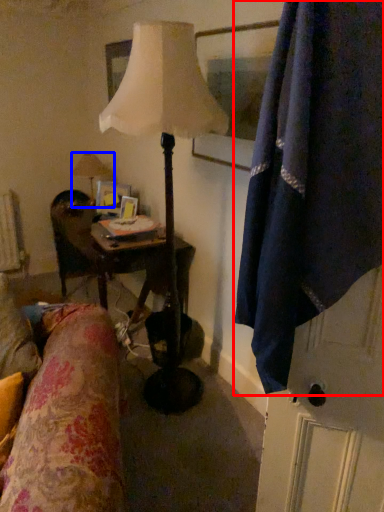
Question: Which object appears farthest to the camera in this image, curtain (highlighted by a red box) or lamp (highlighted by a blue box)?

Choices:
 (A) curtain
 (B) lamp

Answer: (B)